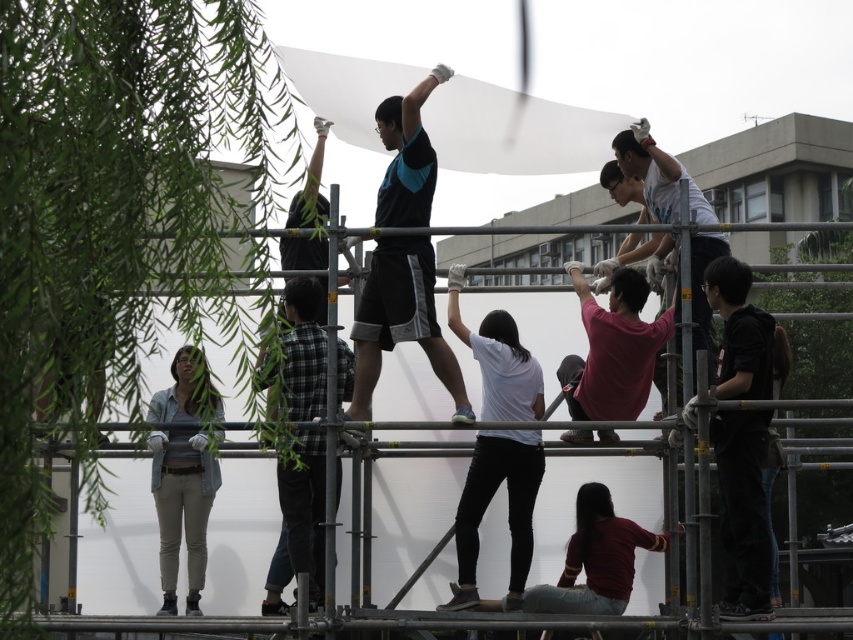
Which is above, metallic scaffolding at center or light blue shirt at upper right?

light blue shirt at upper right is above.

Does metallic scaffolding at center have a smaller size compared to light blue shirt at upper right?

Incorrect, metallic scaffolding at center is not smaller in size than light blue shirt at upper right.

Which is behind, point (334, 392) or point (663, 173)?

Point (663, 173)

This screenshot has width=853, height=640. I want to click on metallic scaffolding at center, so click(422, 499).

Is black matte shorts at center thinner than matte red shirt at center?

No.

Does black matte shorts at center lie in front of matte red shirt at center?

Yes, it is in front of matte red shirt at center.

What do you see at coordinates (399, 321) in the screenshot?
I see `black matte shorts at center` at bounding box center [399, 321].

Where is `black matte shorts at center`? The width and height of the screenshot is (853, 640). black matte shorts at center is located at coordinates (399, 321).

What do you see at coordinates (613, 349) in the screenshot? I see `matte red shirt at center` at bounding box center [613, 349].

Who is more distant from viewer, (647, 371) or (383, 419)?

Positioned behind is point (383, 419).

Is point (610, 380) more distant than point (404, 552)?

No, it is in front of (404, 552).

This screenshot has height=640, width=853. Find the location of `matte red shirt at center`. matte red shirt at center is located at coordinates (613, 349).